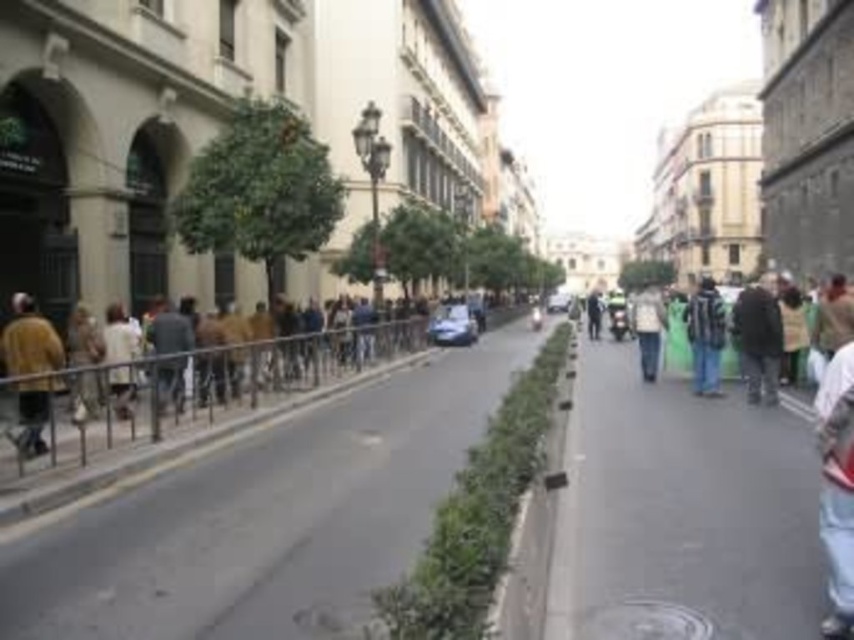
You are a photographer trying to capture both the brown leather jacket at left and the dark green jacket at right in a single frame. Based on their sizes, which jacket will appear smaller in the photo?

The brown leather jacket at left will appear smaller in the photo because it has a lesser width compared to the dark green jacket at right.